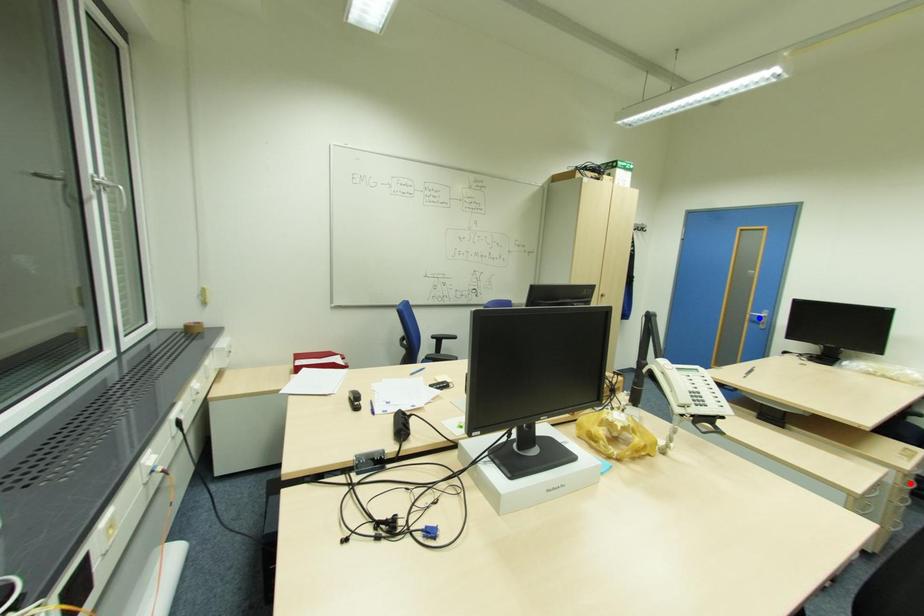
Question: In the image, two points are highlighted. Which point is nearer to the camera? Reply with the corresponding letter.

Choices:
 (A) blue point
 (B) red point

Answer: (B)